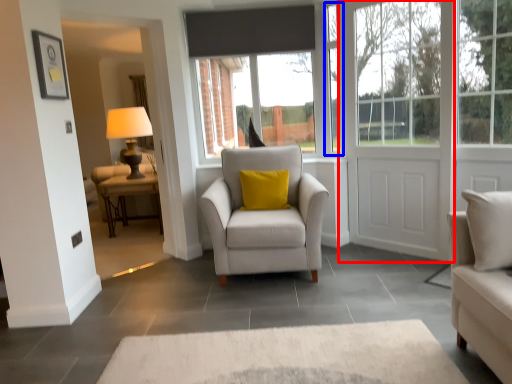
Question: Which object is closer to the camera taking this photo, door (highlighted by a red box) or window frame (highlighted by a blue box)?

Choices:
 (A) door
 (B) window frame

Answer: (A)